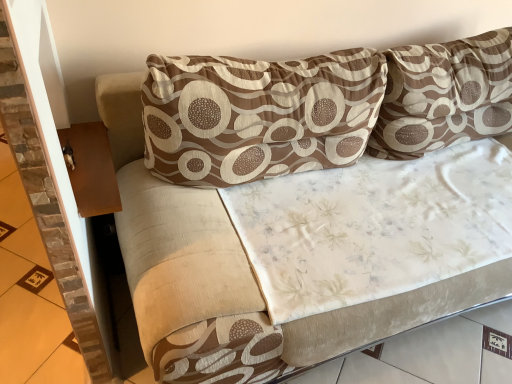
Find the location of a particular element. The width and height of the screenshot is (512, 384). free location above brown wood table at left (from a real-world perspective) is located at coordinates (92, 162).